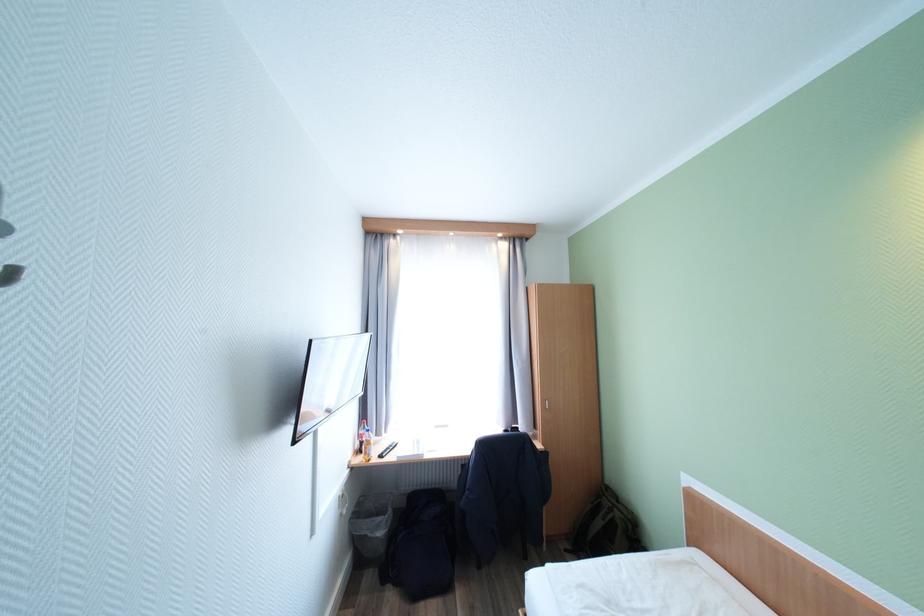
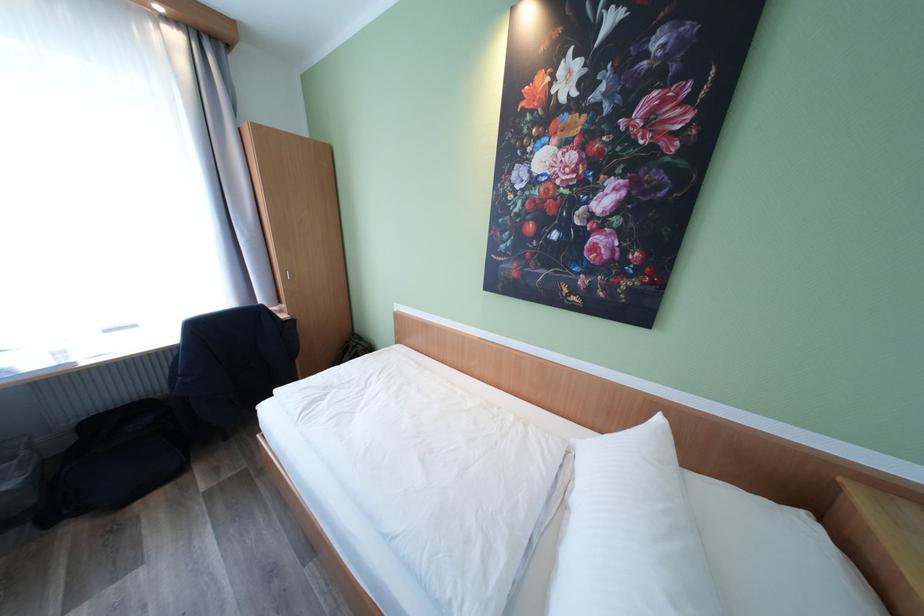
Based on the continuous images, in which direction is the camera rotating?

The camera rotated toward right-down.